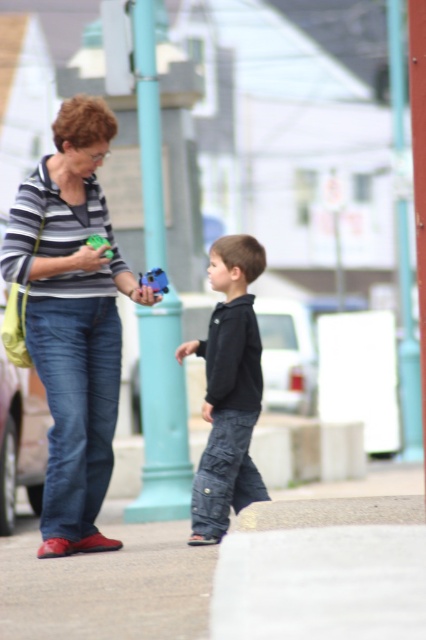
Measure the distance between black cotton hoodie at center and camera.

black cotton hoodie at center and camera are 8.24 meters apart.

Does black cotton hoodie at center have a lesser width compared to matte plastic toy at center?

No.

Describe the element at coordinates (229, 390) in the screenshot. I see `black cotton hoodie at center` at that location.

The width and height of the screenshot is (426, 640). I want to click on black cotton hoodie at center, so click(x=229, y=390).

What are the coordinates of `gray concrete pavement at lower center` in the screenshot? It's located at (108, 584).

Is point (100, 266) closer to viewer compared to point (135, 282)?

Yes, it is.

Is matte green plastic toy at left taller than matte plastic toy at center?

Yes.

Does point (83, 269) lie in front of point (146, 296)?

Yes, it is.

At what (x,y) coordinates should I click in order to perform the action: click on matte green plastic toy at left. Please return your answer as a coordinate pair (x, y). Looking at the image, I should click on (88, 259).